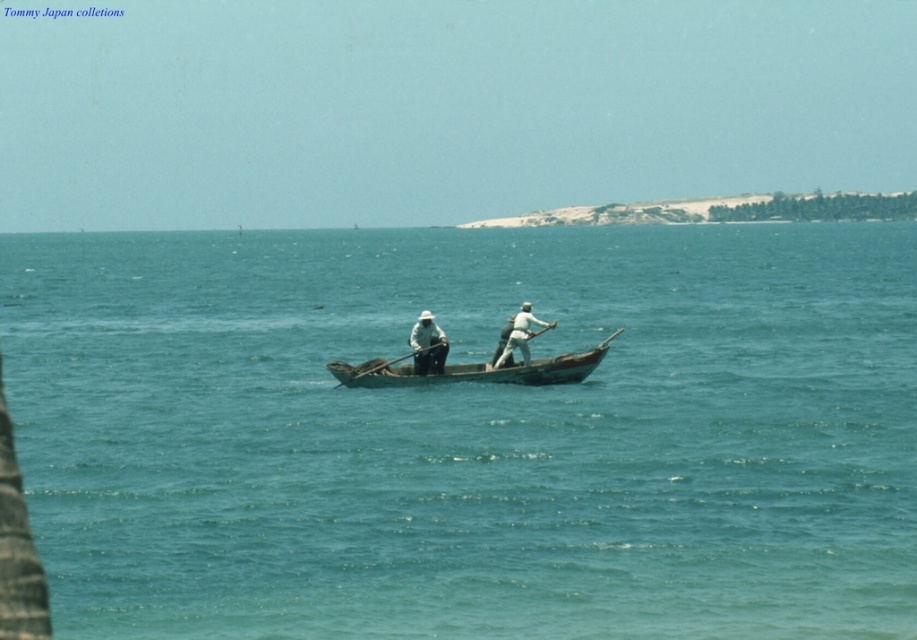
Image resolution: width=917 pixels, height=640 pixels. Describe the element at coordinates (470, 433) in the screenshot. I see `blue water at center` at that location.

Does blue water at center have a smaller size compared to wooden canoe at center?

Incorrect, blue water at center is not smaller in size than wooden canoe at center.

Identify the location of blue water at center. (470, 433).

Locate an element on the screen. The image size is (917, 640). blue water at center is located at coordinates (470, 433).

Is point (264, 248) behind point (444, 339)?

Yes, it is behind point (444, 339).

Can you confirm if blue water at center is taller than wooden paddle at center?

Correct, blue water at center is much taller as wooden paddle at center.

Which is in front, point (59, 417) or point (443, 340)?

Point (59, 417)

The height and width of the screenshot is (640, 917). What are the coordinates of `blue water at center` in the screenshot? It's located at (470, 433).

Does wooden canoe at center lie behind light brown wooden paddle at center?

No.

Looking at this image, who is more distant from viewer, (329, 369) or (526, 330)?

The point (329, 369) is more distant.

Locate an element on the screen. Image resolution: width=917 pixels, height=640 pixels. wooden canoe at center is located at coordinates (473, 371).